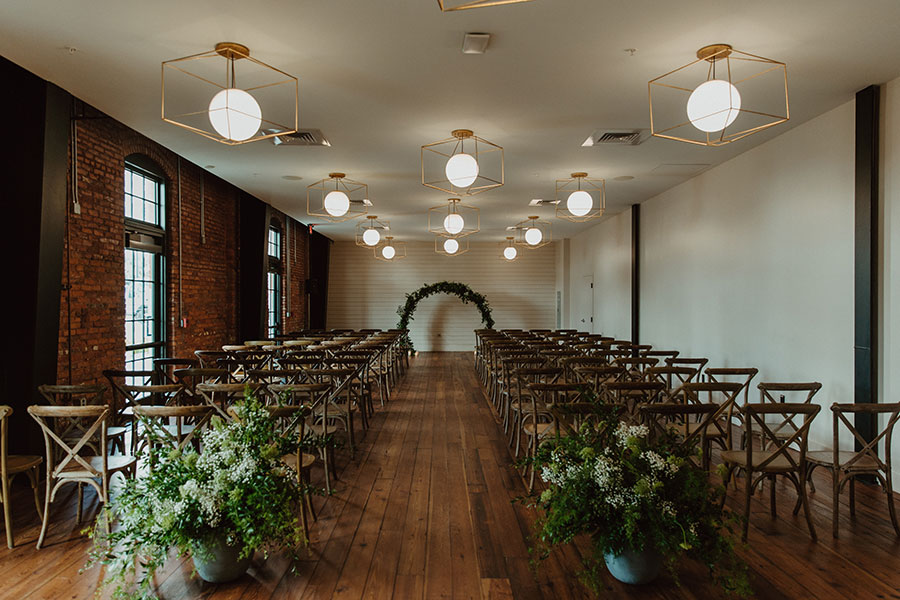
The height and width of the screenshot is (600, 900). Find the location of `painted wall`. painted wall is located at coordinates (751, 283), (596, 266), (506, 288), (887, 353).